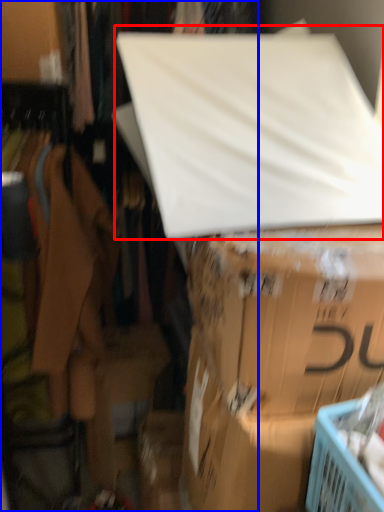
Question: Which point is closer to the camera, linen (highlighted by a red box) or closet (highlighted by a blue box)?

Choices:
 (A) linen
 (B) closet

Answer: (A)